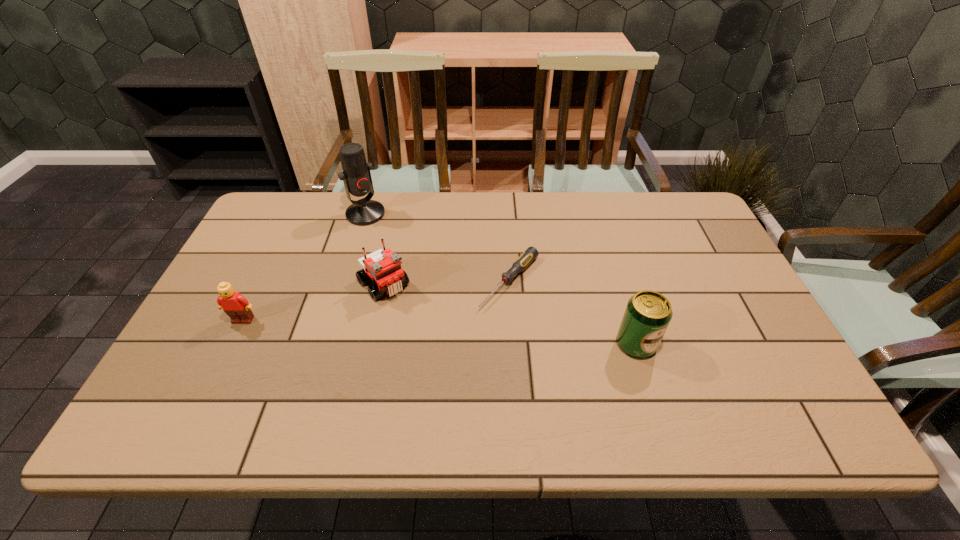
You are a GUI agent. You are given a task and a screenshot of the screen. Output one action in this format:
    pyautogui.click(x=<x>, y=<y>)
    Task: Click on the vacant space located on the right of the beer can
    The height and width of the screenshot is (540, 960).
    Given the screenshot: What is the action you would take?
    pyautogui.click(x=693, y=344)

At what (x,y) coordinates should I click in order to perform the action: click on vacant space located on the front-facing side of the right Lego. Please return your answer as a coordinate pair (x, y). The height and width of the screenshot is (540, 960). Looking at the image, I should click on (418, 322).

You are a GUI agent. You are given a task and a screenshot of the screen. Output one action in this format:
    pyautogui.click(x=<x>, y=<y>)
    Task: Click on the vacant space located 0.060m on the front-facing side of the right Lego
    The width and height of the screenshot is (960, 540).
    Given the screenshot: What is the action you would take?
    pyautogui.click(x=409, y=313)

The image size is (960, 540). I want to click on vacant space situated on the front-facing side of the right Lego, so click(409, 313).

This screenshot has height=540, width=960. Identify the location of vacant space situated 0.170m insert the screwdriver into a screw head. (450, 348).

Locate an element on the screen. Image resolution: width=960 pixels, height=540 pixels. blank area located insert the screwdriver into a screw head is located at coordinates click(440, 359).

In order to click on vacant space located 0.150m insert the screwdriver into a screw head in this screenshot , I will do `click(456, 342)`.

Locate an element on the screen. Image resolution: width=960 pixels, height=540 pixels. free location located on the side of the farthest object with the red ring is located at coordinates (440, 291).

Locate an element on the screen. The height and width of the screenshot is (540, 960). blank space located 0.160m on the side of the farthest object with the red ring is located at coordinates (400, 250).

The height and width of the screenshot is (540, 960). What are the coordinates of `vacant space located 0.250m on the side of the farthest object with the red ring` in the screenshot? It's located at (417, 266).